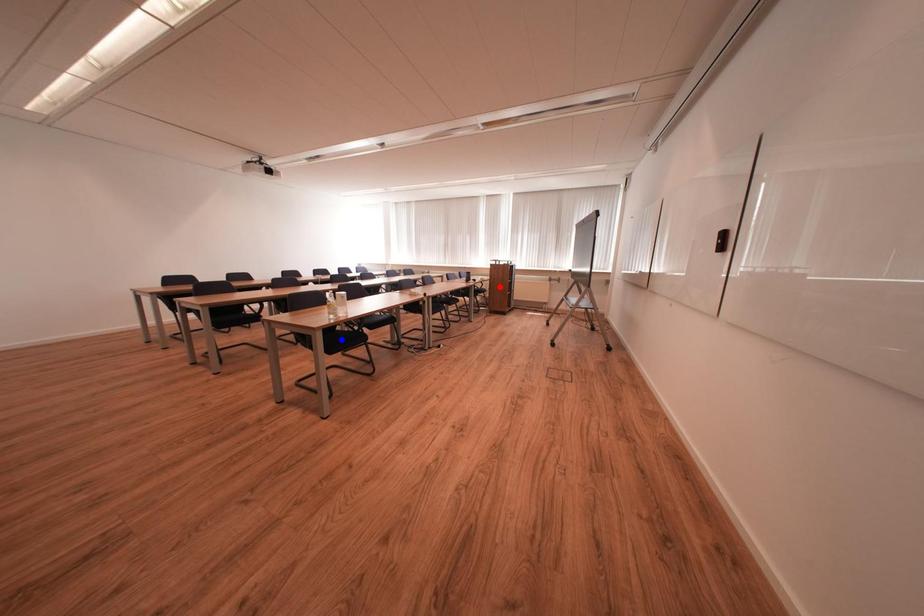
Question: Two points are marked on the image. Which point is closer to the camera?

Choices:
 (A) Blue point is closer.
 (B) Red point is closer.

Answer: (A)